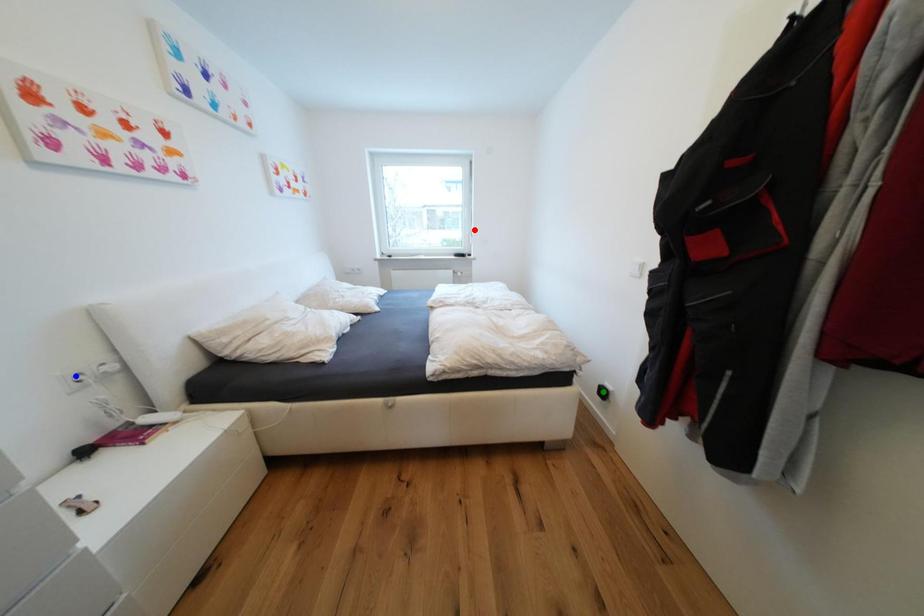
Order these from nearest to farthest:
1. red point
2. green point
3. blue point

red point
green point
blue point